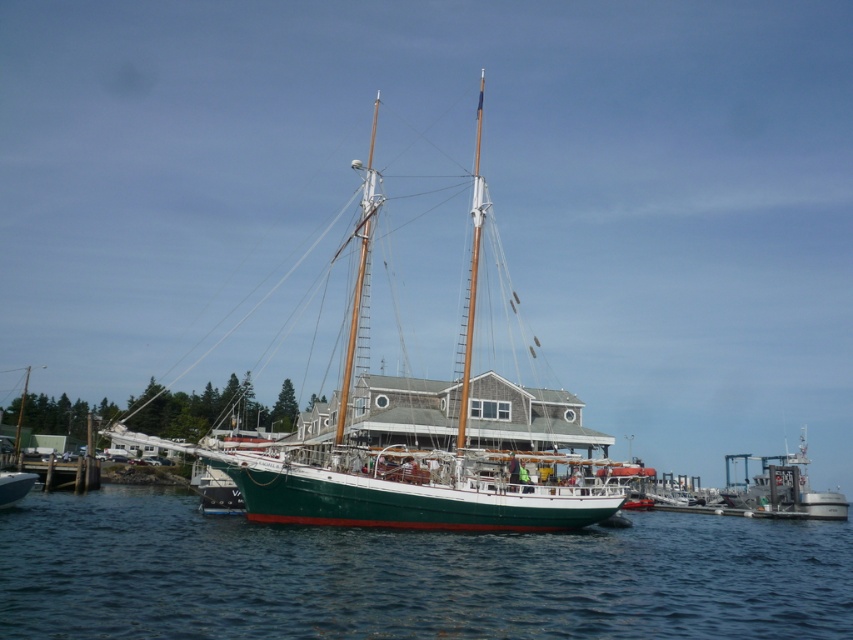
Does green matte sailboat at center have a greater height compared to metallic gray boat at right?

Yes.

Can you confirm if green matte sailboat at center is smaller than metallic gray boat at right?

Actually, green matte sailboat at center might be larger than metallic gray boat at right.

Does point (511, 500) come farther from viewer compared to point (833, 499)?

No.

The width and height of the screenshot is (853, 640). What are the coordinates of `green matte sailboat at center` in the screenshot? It's located at (415, 444).

From the picture: Can you confirm if green matte water at center is wider than metallic gray boat at right?

No.

Can you confirm if green matte water at center is bigger than metallic gray boat at right?

Actually, green matte water at center might be smaller than metallic gray boat at right.

Which is in front, point (169, 582) or point (772, 456)?

Point (169, 582)

Locate an element on the screen. The width and height of the screenshot is (853, 640). green matte water at center is located at coordinates tap(408, 577).

Does point (397, 564) come farther from viewer compared to point (473, 196)?

That is False.

The width and height of the screenshot is (853, 640). Describe the element at coordinates (408, 577) in the screenshot. I see `green matte water at center` at that location.

Does point (381, 620) come behind point (589, 484)?

That is False.

Identify the location of green matte water at center. (408, 577).